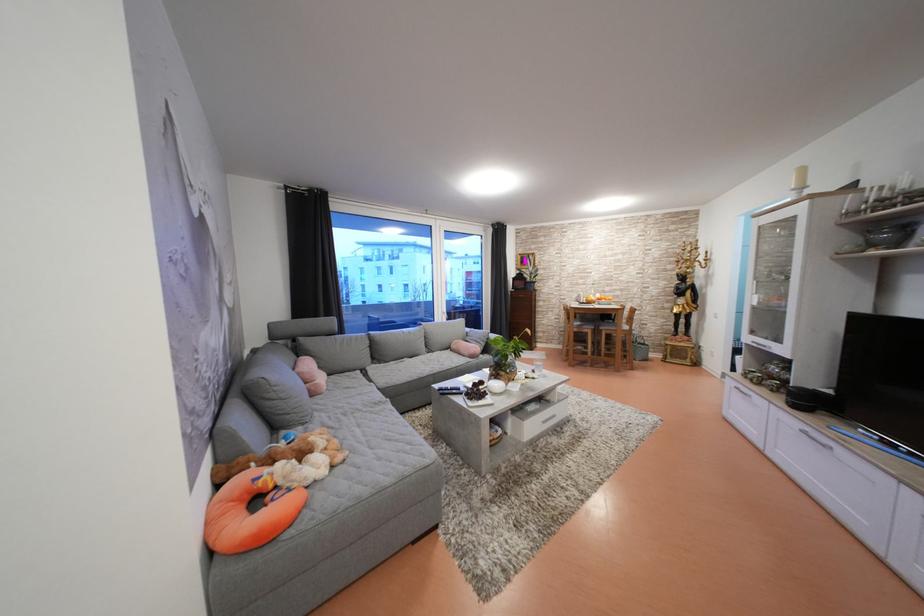
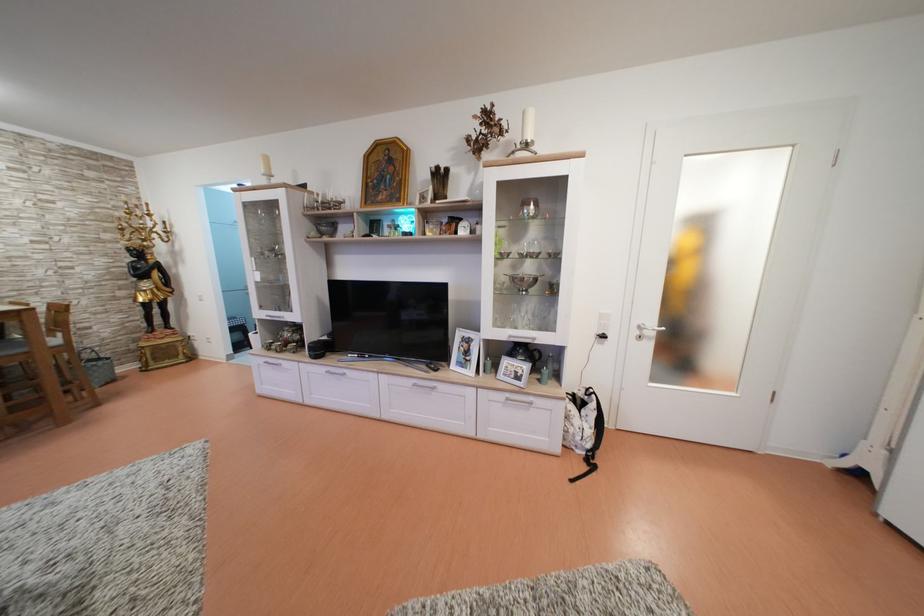
Question: The first image is from the beginning of the video and the second image is from the end. How did the camera likely rotate when shooting the video?

Choices:
 (A) Left
 (B) Right
 (C) Up
 (D) Down

Answer: (B)